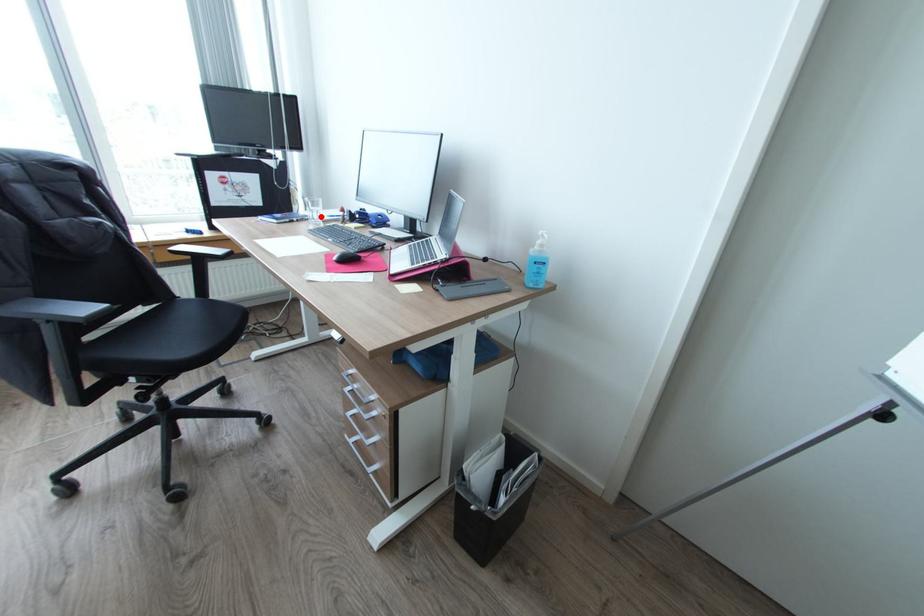
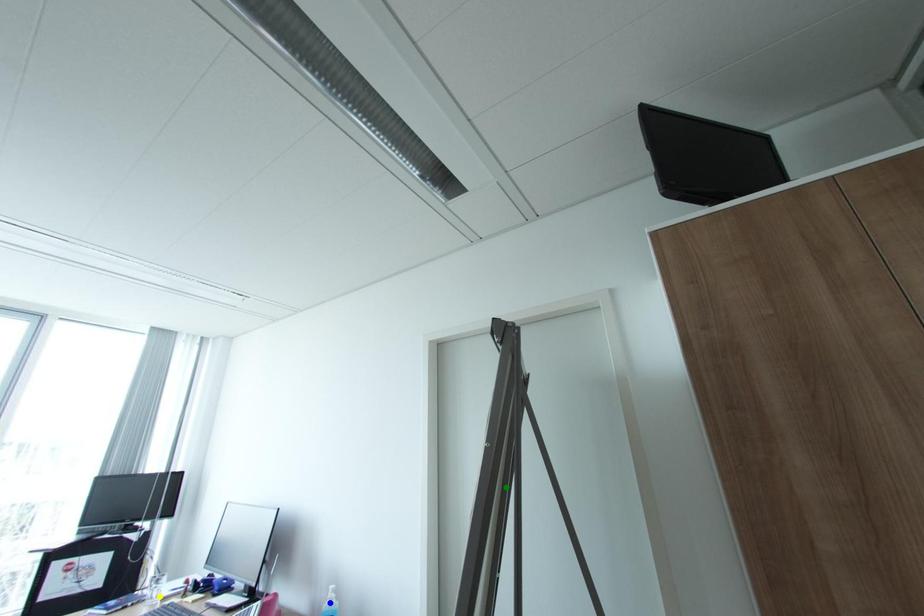
Question: I am providing you with two images of the same scene from different viewpoints. A red point is marked on the first image. You are given multiple points on the second image. In image 2, which mark is for the same physical point as the one in image 1?

Choices:
 (A) yellow point
 (B) green point
 (C) blue point

Answer: (A)